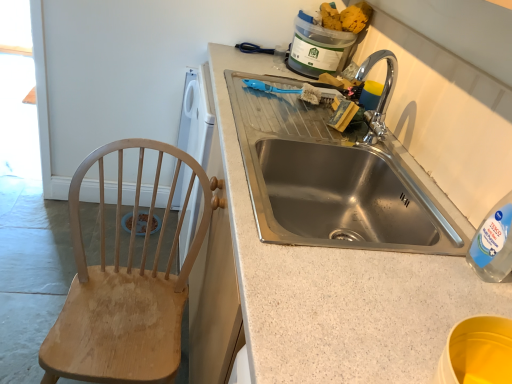
Measure the distance between yellow sponge at upper right and camera.

1.63 meters.

What do you see at coordinates (124, 289) in the screenshot?
I see `wooden chair at left` at bounding box center [124, 289].

The height and width of the screenshot is (384, 512). Find the location of `stainless steel sink at center`. stainless steel sink at center is located at coordinates (331, 180).

Based on their sizes in the image, would you say granite countertop at center is bigger or smaller than stainless steel sink at center?

granite countertop at center is bigger than stainless steel sink at center.

Which is more to the left, granite countertop at center or stainless steel sink at center?

From the viewer's perspective, granite countertop at center appears more on the left side.

How different are the orientations of granite countertop at center and stainless steel sink at center in degrees?

granite countertop at center and stainless steel sink at center are facing 0.353 degrees away from each other.

Is granite countertop at center not within stainless steel sink at center?

granite countertop at center is positioned outside stainless steel sink at center.

Is yellow sponge at upper right not close to granite countertop at center?

Yes, yellow sponge at upper right and granite countertop at center are located far from each other.

This screenshot has width=512, height=384. I want to click on food behind the granite countertop at center, so click(x=346, y=17).

From a real-world perspective, which object rests below the other?

In real-world perspective, granite countertop at center is lower.

Considering the sizes of yellow sponge at upper right and granite countertop at center in the image, is yellow sponge at upper right bigger or smaller than granite countertop at center?

Considering their sizes, yellow sponge at upper right takes up less space than granite countertop at center.

Are yellow sponge at upper right and wooden chair at left located far from each other?

yellow sponge at upper right is positioned a significant distance from wooden chair at left.

Considering the relative sizes of yellow sponge at upper right and wooden chair at left in the image provided, is yellow sponge at upper right smaller than wooden chair at left?

Correct, yellow sponge at upper right occupies less space than wooden chair at left.

Is yellow sponge at upper right oriented away from wooden chair at left?

No.

Is point (343, 16) closer or farther from the camera than point (138, 177)?

Clearly, point (343, 16) is more distant from the camera than point (138, 177).

Which of these two, granite countertop at center or yellow sponge at upper right, is bigger?

granite countertop at center.

Measure the distance between granite countertop at center and yellow sponge at upper right.

granite countertop at center and yellow sponge at upper right are 3.37 feet apart from each other.

Is granite countertop at center not close to yellow sponge at upper right?

That's right, there is a large distance between granite countertop at center and yellow sponge at upper right.

Between point (477, 284) and point (355, 22), which one is positioned in front?

Positioned in front is point (477, 284).

From a real-world perspective, which object rests below the other?

wooden chair at left.

Which object is closer to the camera taking this photo, wooden chair at left or yellow sponge at upper right?

wooden chair at left is in front.

Is wooden chair at left turned away from yellow sponge at upper right?

wooden chair at left does not have its back to yellow sponge at upper right.

Between wooden chair at left and granite countertop at center, which one appears on the left side from the viewer's perspective?

Positioned to the left is wooden chair at left.

Is wooden chair at left completely or partially outside of granite countertop at center?

Indeed, wooden chair at left is completely outside granite countertop at center.

Is granite countertop at center at the back of wooden chair at left?

That's not correct — wooden chair at left is not looking away from granite countertop at center.

Between wooden chair at left and stainless steel sink at center, which one appears on the right side from the viewer's perspective?

stainless steel sink at center is more to the right.

From a real-world perspective, relative to stainless steel sink at center, is wooden chair at left vertically above or below?

wooden chair at left is below stainless steel sink at center.

In terms of size, does wooden chair at left appear bigger or smaller than stainless steel sink at center?

Clearly, wooden chair at left is larger in size than stainless steel sink at center.

Would you consider wooden chair at left to be distant from stainless steel sink at center?

They are positioned close to each other.

This screenshot has width=512, height=384. In order to click on sink that is behind the granite countertop at center in this screenshot , I will do `click(331, 180)`.

Identify the location of food above the granite countertop at center (from a real-world perspective). (346, 17).

When comparing their distances from granite countertop at center, does stainless steel sink at center or yellow sponge at upper right seem further?

The object further to granite countertop at center is yellow sponge at upper right.

Estimate the real-world distances between objects in this image. Which object is closer to granite countertop at center, wooden chair at left or stainless steel sink at center?

The object closer to granite countertop at center is stainless steel sink at center.

Looking at the image, which one is located further to yellow sponge at upper right, wooden chair at left or granite countertop at center?

The object further to yellow sponge at upper right is wooden chair at left.

Based on their spatial positions, is granite countertop at center or yellow sponge at upper right further from wooden chair at left?

yellow sponge at upper right is positioned further to the anchor wooden chair at left.

Which object lies further to the anchor point granite countertop at center, wooden chair at left or yellow sponge at upper right?

Based on the image, yellow sponge at upper right appears to be further to granite countertop at center.

From the image, which object appears to be farther from granite countertop at center, yellow sponge at upper right or stainless steel sink at center?

Based on the image, yellow sponge at upper right appears to be further to granite countertop at center.

Estimate the real-world distances between objects in this image. Which object is further from yellow sponge at upper right, stainless steel sink at center or granite countertop at center?

granite countertop at center is further to yellow sponge at upper right.

Looking at the image, which one is located further to stainless steel sink at center, wooden chair at left or yellow sponge at upper right?

yellow sponge at upper right.

Find the location of a particular element. countertop between wooden chair at left and stainless steel sink at center is located at coordinates (337, 287).

The image size is (512, 384). In order to click on sink that lies between yellow sponge at upper right and granite countertop at center from top to bottom in this screenshot , I will do `click(331, 180)`.

Locate an element on the screen. This screenshot has width=512, height=384. sink that lies between yellow sponge at upper right and wooden chair at left from top to bottom is located at coordinates (331, 180).

Locate an element on the screen. This screenshot has height=384, width=512. countertop that lies between yellow sponge at upper right and wooden chair at left from top to bottom is located at coordinates (337, 287).